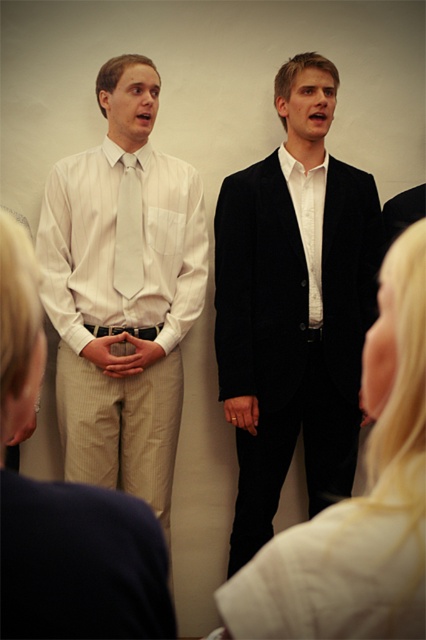
You are an interior designer who needs to place a decorative item at the exact center of the room. The white satin shirt at left is located at point 0.388, 0.282. Where should you place the decorative item to ensure it is centered?

The exact center of the room would be at point (x=213, y=320). Since the white satin shirt at left is at (x=120, y=248), you should position the decorative item at (x=213, y=320) to center it in the room.

You are a photographer setting up for a group photo. You need to position the white satin shirt at left and the matte white tie at center so that they are aligned properly. According to the scene, which object should be moved to the right to achieve this alignment?

The white satin shirt at left is to the left of the matte white tie at center. To align them properly, the white satin shirt at left should be moved to the right so that it is positioned next to or in line with the matte white tie at center.

You are a photographer setting up for a group photo in the scene described. You need to ensure that both the white satin shirt at left and the matte white tie at center are clearly visible in the frame. Given their height difference, which object might require you to adjust your camera angle to avoid being obscured?

The matte white tie at center is shorter than the white satin shirt at left, so the matte white tie at center might be partially obscured if the camera is positioned too high. Lowering the camera angle could help ensure both are visible.